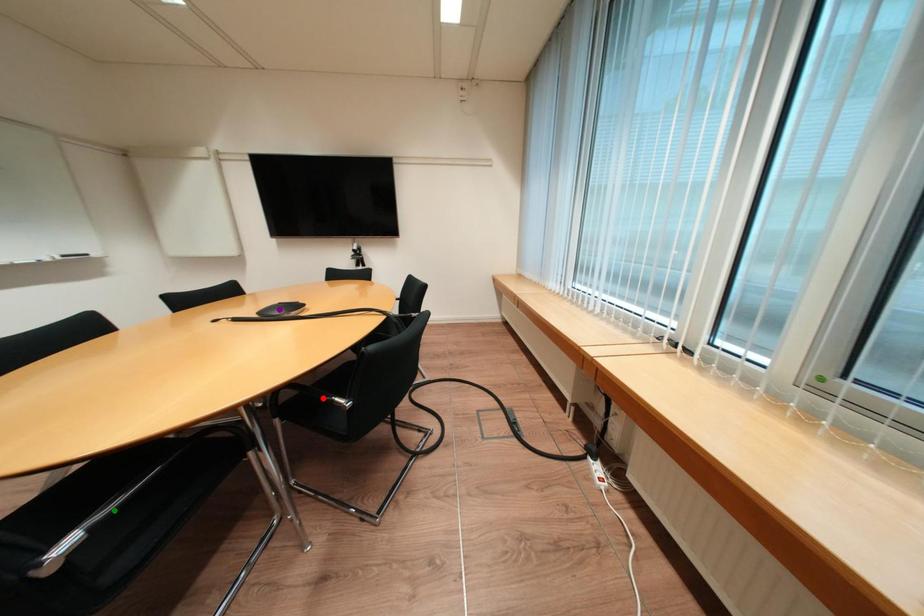
Order these from nearest to farthest:
green point, purple point, red point

1. green point
2. red point
3. purple point